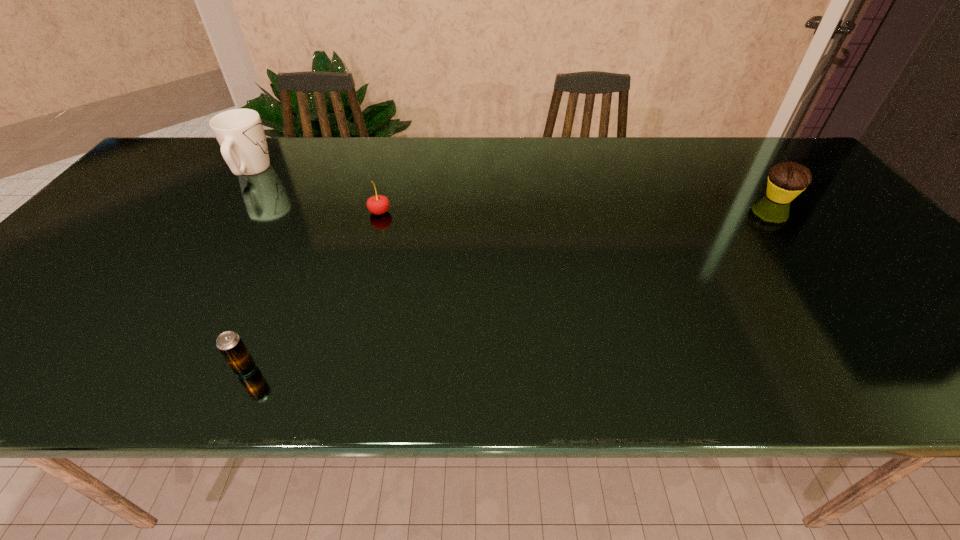
Identify the location of vacant space located on the right of the nearest object. The height and width of the screenshot is (540, 960). (465, 368).

Identify the location of object positioned at the far edge. This screenshot has height=540, width=960. (240, 133).

Where is `object that is at the near edge`? This screenshot has width=960, height=540. object that is at the near edge is located at coordinates (230, 345).

Identify the location of object that is at the right edge. The image size is (960, 540). (786, 180).

In the image, there is a desktop. Identify the location of vacant space at the far edge. Image resolution: width=960 pixels, height=540 pixels. (555, 177).

In the image, there is a desktop. What are the coordinates of `free space at the near edge` in the screenshot? It's located at (187, 364).

Locate an element on the screen. The width and height of the screenshot is (960, 540). vacant space at the left edge of the desktop is located at coordinates (190, 181).

I want to click on vacant region at the right edge of the desktop, so click(x=810, y=200).

Where is `vacant area that lies between the third object from left to right and the second object from left to right`? The image size is (960, 540). vacant area that lies between the third object from left to right and the second object from left to right is located at coordinates (313, 291).

In order to click on vacant point located between the beer can and the rightmost object in this screenshot , I will do `click(512, 283)`.